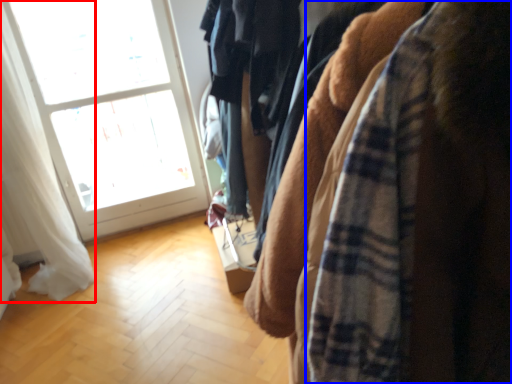
Question: Which of the following is the closest to the observer, curtain (highlighted by a red box) or flannel (highlighted by a blue box)?

Choices:
 (A) curtain
 (B) flannel

Answer: (B)